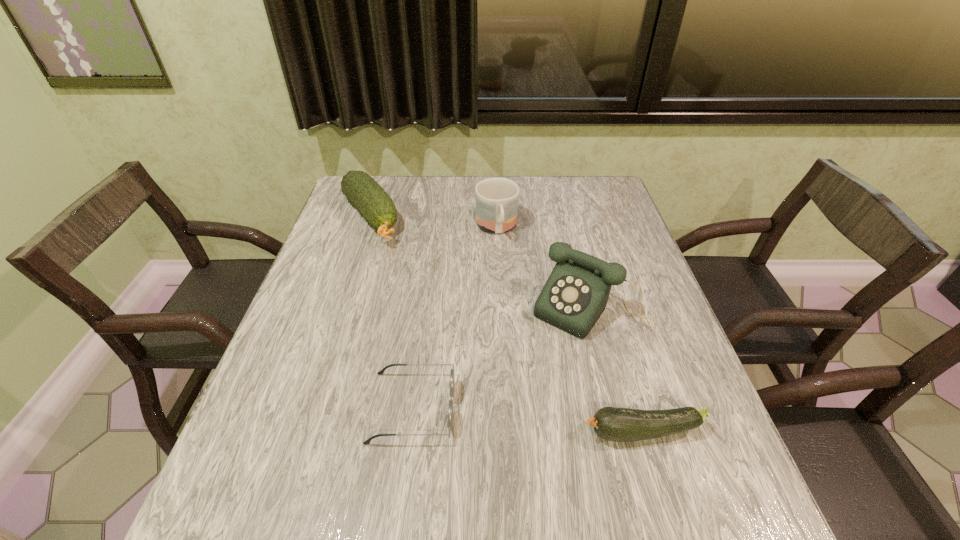
Image resolution: width=960 pixels, height=540 pixels. In order to click on vacant area located 0.360m at the blossom end of the zucchini in this screenshot , I will do `click(390, 432)`.

Locate an element on the screen. vacant space located 0.360m on the side with the handle of the third object from left to right is located at coordinates (522, 343).

Identify the location of vacant region located 0.340m on the side with the handle of the third object from left to right. Image resolution: width=960 pixels, height=540 pixels. (521, 337).

This screenshot has height=540, width=960. Find the location of `vacant space located 0.400m on the side with the handle of the third object from left to right`. vacant space located 0.400m on the side with the handle of the third object from left to right is located at coordinates (526, 358).

Locate an element on the screen. The width and height of the screenshot is (960, 540). vacant space located 0.180m on the dial of the telephone is located at coordinates (521, 389).

Where is `vacant space situated 0.200m on the dial of the telephone`? vacant space situated 0.200m on the dial of the telephone is located at coordinates (516, 396).

This screenshot has width=960, height=540. In order to click on free space located 0.210m on the dial of the telephone in this screenshot , I will do `click(514, 400)`.

The image size is (960, 540). Identify the location of vacant region located 0.310m at the blossom end of the cucumber. (426, 314).

You are a GUI agent. You are given a task and a screenshot of the screen. Output one action in this format:
    pyautogui.click(x=<x>, y=<y>)
    Task: Click on the vacant space located at the blossom end of the cucumber
    The image size is (960, 540).
    Given the screenshot: What is the action you would take?
    pyautogui.click(x=416, y=299)

Where is `free location located at the blossom end of the cucumber`? free location located at the blossom end of the cucumber is located at coordinates (415, 297).